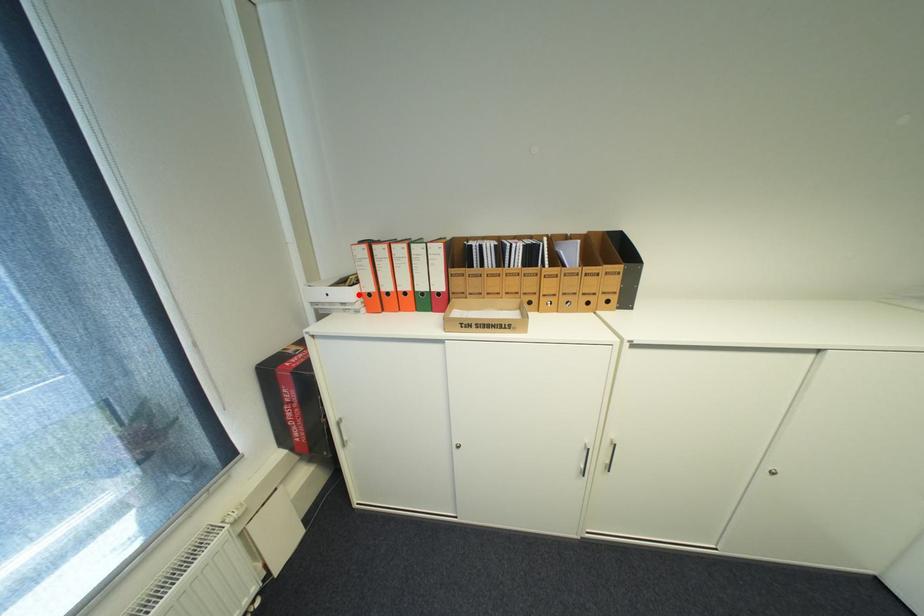
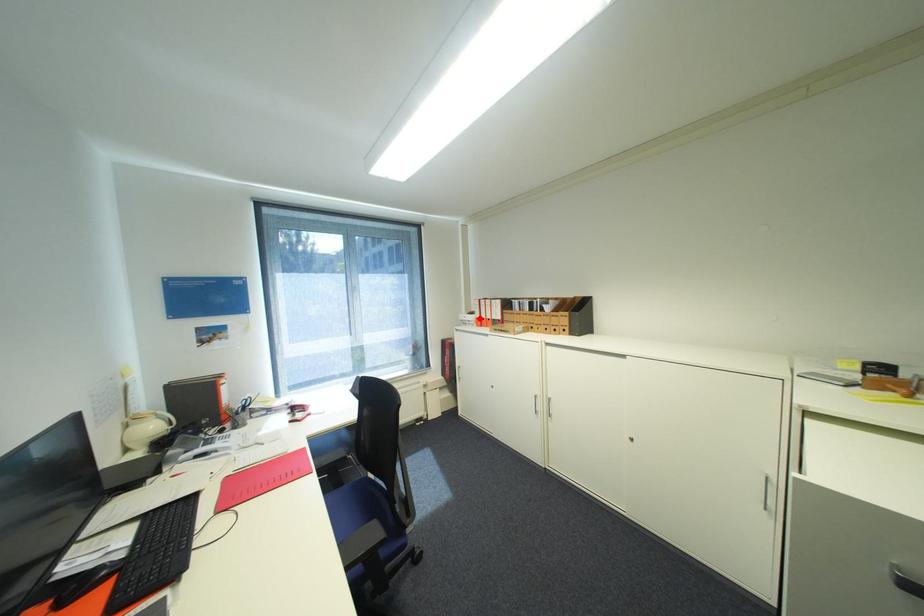
I am providing you with two images of the same scene from different viewpoints. A red point is marked on the first image and another point is marked on the second image. Is the marked point in image1 the same physical position as the marked point in image2?

Yes